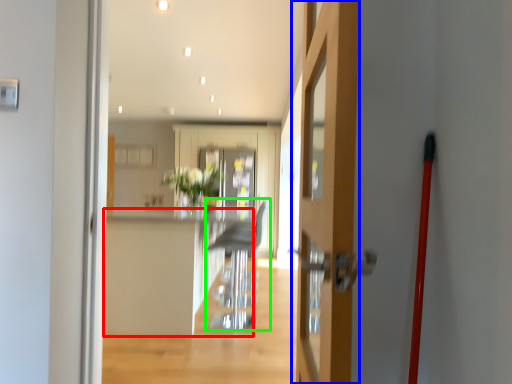
Question: Estimate the real-world distances between objects in this image. Which object is farther from counter top (highlighted by a red box), door (highlighted by a blue box) or armchair (highlighted by a green box)?

Choices:
 (A) door
 (B) armchair

Answer: (A)